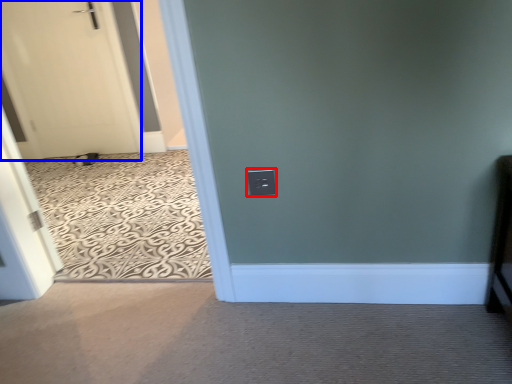
Question: Which of the following is the closest to the observer, electric outlet (highlighted by a red box) or door (highlighted by a blue box)?

Choices:
 (A) electric outlet
 (B) door

Answer: (A)